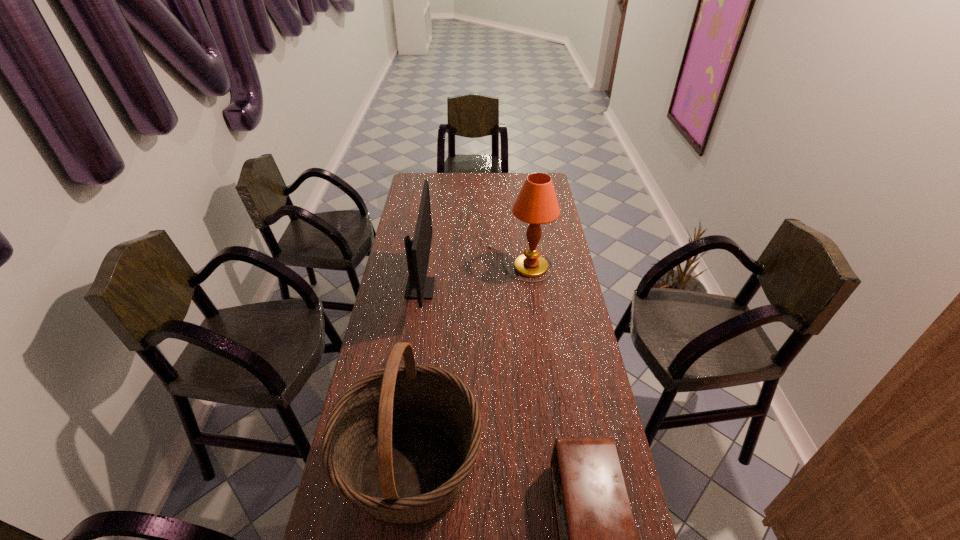
The width and height of the screenshot is (960, 540). In order to click on blank region between the lamp and the computer monitor in this screenshot , I will do `click(470, 276)`.

You are a GUI agent. You are given a task and a screenshot of the screen. Output one action in this format:
    pyautogui.click(x=<x>, y=<y>)
    Task: Click on the free space between the computer monitor and the lamp
    
    Given the screenshot: What is the action you would take?
    pyautogui.click(x=470, y=276)

The image size is (960, 540). What are the coordinates of `blank region between the lamp and the computer monitor` in the screenshot? It's located at (470, 276).

Locate which object is the second closest to the shortest object. Please provide its 2D coordinates. Your answer should be formatted as a tuple, i.e. [(x, y)], where the tuple contains the x and y coordinates of a point satisfying the conditions above.

[(420, 287)]

You are a GUI agent. You are given a task and a screenshot of the screen. Output one action in this format:
    pyautogui.click(x=<x>, y=<y>)
    Task: Click on the object that is the second closest to the radio receiver
    Image resolution: width=960 pixels, height=540 pixels.
    Given the screenshot: What is the action you would take?
    pyautogui.click(x=420, y=287)